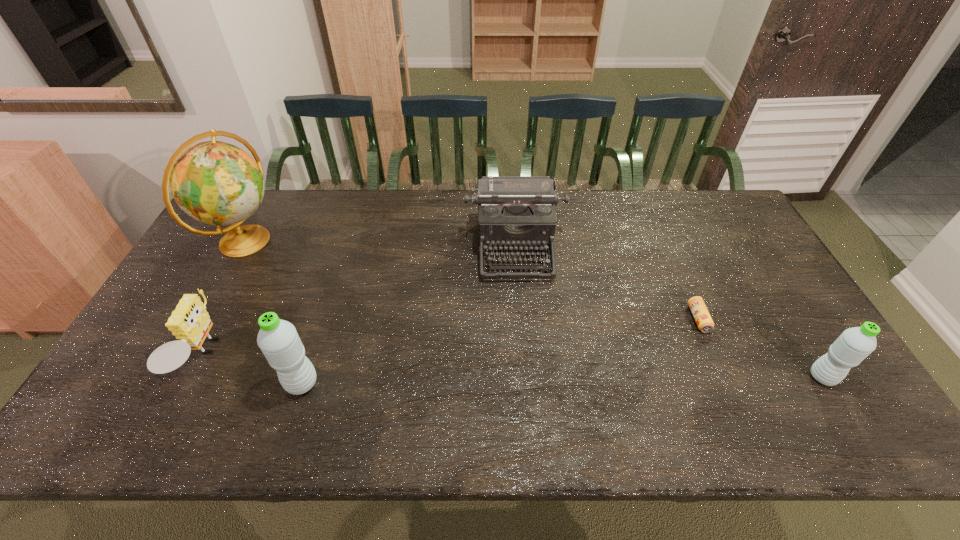
I want to click on vacant space that is in between the fourth object from left to right and the beer can, so click(607, 284).

At what (x,y) coordinates should I click in order to perform the action: click on empty space between the globe and the second shortest object. Please return your answer as a coordinate pair (x, y). The height and width of the screenshot is (540, 960). Looking at the image, I should click on (224, 299).

In order to click on unoccupied area between the second tallest object and the right water bottle in this screenshot , I will do `click(563, 380)`.

Find the location of a particular element. empty space between the tallest object and the fifth tallest object is located at coordinates (224, 299).

I want to click on free space between the typewriter and the taller water bottle, so click(408, 316).

This screenshot has height=540, width=960. I want to click on empty location between the sponge and the typewriter, so pyautogui.click(x=359, y=302).

I want to click on free spot between the fourth object from left to right and the sponge, so click(359, 302).

You are a GUI agent. You are given a task and a screenshot of the screen. Output one action in this format:
    pyautogui.click(x=<x>, y=<y>)
    Task: Click on the empty space between the fourth object from right to left and the second shortest object
    Image resolution: width=960 pixels, height=540 pixels.
    Given the screenshot: What is the action you would take?
    pyautogui.click(x=252, y=370)

At what (x,y) coordinates should I click in order to perform the action: click on vacant area that lies between the beer can and the shorter water bottle. Please return your answer as a coordinate pair (x, y). The width and height of the screenshot is (960, 540). Looking at the image, I should click on (760, 348).

Locate an element on the screen. This screenshot has width=960, height=540. object that is the fifth closest to the fourth object from right to left is located at coordinates (854, 344).